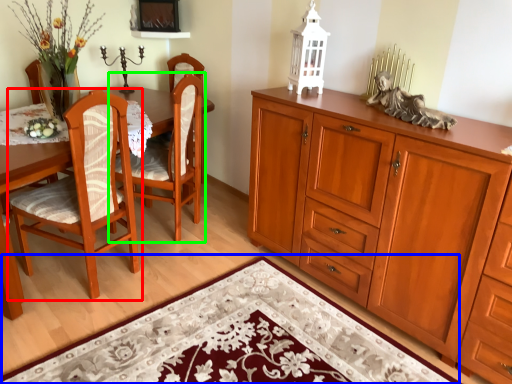
Question: Based on their relative distances, which object is nearer to chair (highlighted by a red box)? Choose from doormat (highlighted by a blue box) and chair (highlighted by a green box).

Choices:
 (A) doormat
 (B) chair

Answer: (B)